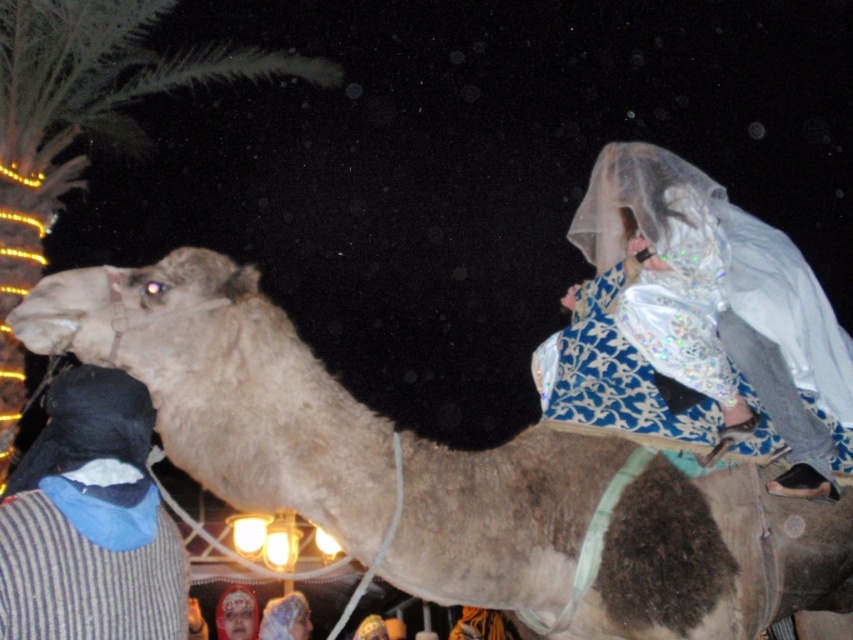
Does shiny silver dress at upper right have a larger size compared to black fabric at left?

Yes.

Is shiny silver dress at upper right taller than black fabric at left?

Yes.

This screenshot has height=640, width=853. In order to click on shiny silver dress at upper right in this screenshot , I will do `click(701, 324)`.

Is point (671, 492) in front of point (164, 76)?

That is True.

From the picture: Does fuzzy beige camel at center have a larger size compared to green leafy palm at upper left?

Actually, fuzzy beige camel at center might be smaller than green leafy palm at upper left.

Find the location of a particular element. The height and width of the screenshot is (640, 853). fuzzy beige camel at center is located at coordinates (225, 387).

Is point (68, 456) closer to camera compared to point (4, 109)?

Yes, it is in front of point (4, 109).

Does point (131, 518) lie behind point (67, 22)?

No, (131, 518) is closer to viewer.

What do you see at coordinates (90, 524) in the screenshot?
I see `black fabric at left` at bounding box center [90, 524].

You are a GUI agent. You are given a task and a screenshot of the screen. Output one action in this format:
    pyautogui.click(x=<x>, y=<y>)
    Task: Click on the black fabric at left
    The width and height of the screenshot is (853, 640).
    Given the screenshot: What is the action you would take?
    pyautogui.click(x=90, y=524)